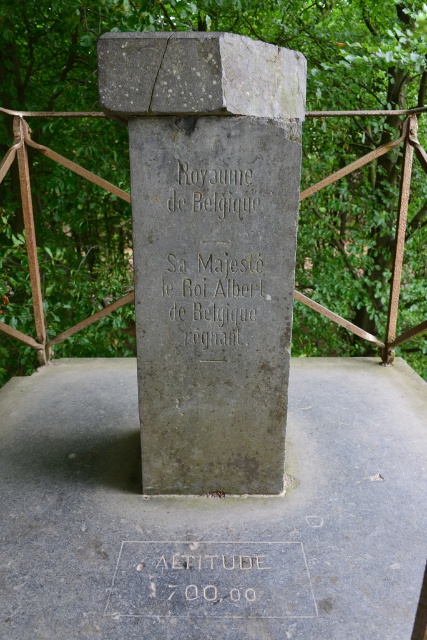
Question: Is gray concrete at center thinner than etched stone altitude at center?

Choices:
 (A) no
 (B) yes

Answer: (A)

Question: Based on their relative distances, which object is nearer to the gray concrete at center?

Choices:
 (A) gray stone monument at center
 (B) etched stone altitude at center
 (C) black stone engraving at center

Answer: (B)

Question: Does gray concrete at center have a lesser width compared to gray stone monument at center?

Choices:
 (A) yes
 (B) no

Answer: (B)

Question: Does black stone engraving at center have a lesser width compared to etched stone altitude at center?

Choices:
 (A) no
 (B) yes

Answer: (B)

Question: Which object is the closest to the gray concrete at center?

Choices:
 (A) gray stone monument at center
 (B) etched stone altitude at center

Answer: (B)

Question: Which point appears farthest from the camera in this image?

Choices:
 (A) (34, 584)
 (B) (266, 168)
 (C) (215, 316)
 (D) (239, 580)

Answer: (C)